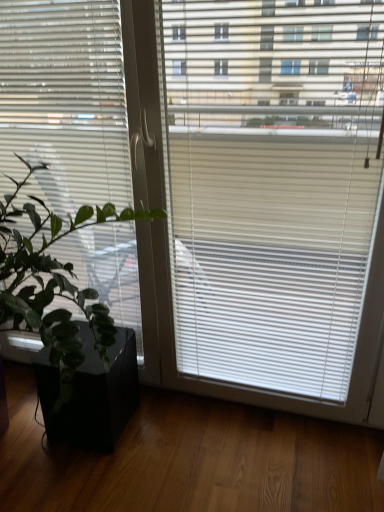
What is the approximate height of green matte plant at left?

1.27 meters.

The width and height of the screenshot is (384, 512). In order to click on white matte window blind at left in this screenshot , I will do `click(65, 102)`.

Between green matte plant at left and black matte flowerpot at lower left, which one appears on the right side from the viewer's perspective?

From the viewer's perspective, black matte flowerpot at lower left appears more on the right side.

Which is closer to the camera, (122, 368) or (134, 394)?

The point (122, 368) is more forward.

Considering the sizes of green matte plant at left and black matte flowerpot at lower left in the image, is green matte plant at left wider or thinner than black matte flowerpot at lower left?

In the image, green matte plant at left appears to be wider than black matte flowerpot at lower left.

From a real-world perspective, is black matte flowerpot at lower left positioned above or below green matte plant at left?

In terms of real-world spatial position, black matte flowerpot at lower left is below green matte plant at left.

Between black matte flowerpot at lower left and green matte plant at left, which one appears on the left side from the viewer's perspective?

Positioned to the left is green matte plant at left.

From the image's perspective, which is below, black matte flowerpot at lower left or green matte plant at left?

black matte flowerpot at lower left appears lower in the image.

Is black matte flowerpot at lower left wider than green matte plant at left?

No.

I want to click on window blind above the green matte plant at left (from a real-world perspective), so click(65, 102).

Based on the photo, would you say green matte plant at left is outside white matte window blind at left?

Yes, green matte plant at left is located beyond the bounds of white matte window blind at left.

Does green matte plant at left lie in front of white matte window blind at left?

Yes, it is.

Is green matte plant at left far away from white matte window blind at left?

green matte plant at left is actually quite close to white matte window blind at left.

Is point (105, 412) in front of point (138, 272)?

That is True.

From a real-world perspective, is black matte flowerpot at lower left below white matte window blind at left?

Yes, from a real-world perspective, black matte flowerpot at lower left is beneath white matte window blind at left.

From the image's perspective, which is above, black matte flowerpot at lower left or white matte window blind at left?

white matte window blind at left is shown above in the image.

From the image's perspective, which one is positioned higher, white matte window blind at left or green matte plant at left?

white matte window blind at left appears higher in the image.

Does white matte window blind at left come behind green matte plant at left?

That is True.

From a real-world perspective, is white matte window blind at left on top of green matte plant at left?

Yes, from a real-world perspective, white matte window blind at left is over green matte plant at left

Is white matte window blind at left not within green matte plant at left?

No, white matte window blind at left is not entirely external to green matte plant at left.

Is white matte window blind at left next to black matte flowerpot at lower left and touching it?

No, white matte window blind at left is not next to black matte flowerpot at lower left.

Is white matte window blind at left oriented towards black matte flowerpot at lower left?

Yes, white matte window blind at left is turned towards black matte flowerpot at lower left.

Does white matte window blind at left have a greater width compared to black matte flowerpot at lower left?

No.

Find the location of a particular element. This screenshot has height=512, width=384. flowerpot located on the right of white matte window blind at left is located at coordinates (91, 393).

At what (x,y) coordinates should I click in order to perform the action: click on houseplant located in front of the black matte flowerpot at lower left. Please return your answer as a coordinate pair (x, y). Looking at the image, I should click on (68, 322).

What are the coordinates of `flowerpot lying behind the green matte plant at left` in the screenshot? It's located at (91, 393).

Looking at the image, which one is located further to white matte window blind at left, black matte flowerpot at lower left or green matte plant at left?

Based on the image, black matte flowerpot at lower left appears to be further to white matte window blind at left.

Estimate the real-world distances between objects in this image. Which object is closer to black matte flowerpot at lower left, green matte plant at left or white matte window blind at left?

green matte plant at left.

Considering their positions, is white matte window blind at left positioned further to green matte plant at left than black matte flowerpot at lower left?

white matte window blind at left.

When comparing their distances from green matte plant at left, does black matte flowerpot at lower left or white matte window blind at left seem further?

white matte window blind at left is positioned further to the anchor green matte plant at left.

When comparing their distances from black matte flowerpot at lower left, does white matte window blind at left or green matte plant at left seem further?

white matte window blind at left is further to black matte flowerpot at lower left.

Looking at the image, which one is located further to white matte window blind at left, green matte plant at left or black matte flowerpot at lower left?

Among the two, black matte flowerpot at lower left is located further to white matte window blind at left.

Find the location of a particular element. window blind positioned between green matte plant at left and black matte flowerpot at lower left from near to far is located at coordinates (65, 102).